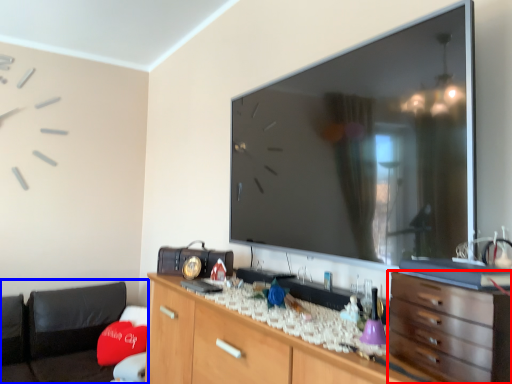
Question: Which of the following is the closest to the observer, chest of drawers (highlighted by a red box) or bean bag chair (highlighted by a blue box)?

Choices:
 (A) chest of drawers
 (B) bean bag chair

Answer: (A)